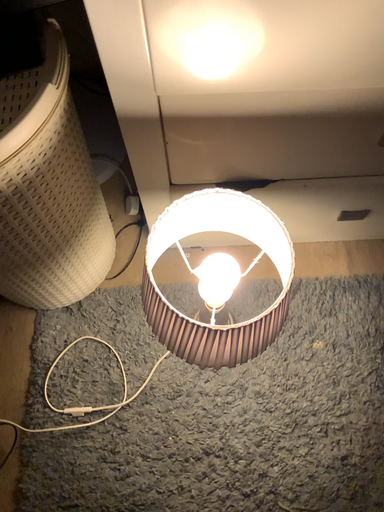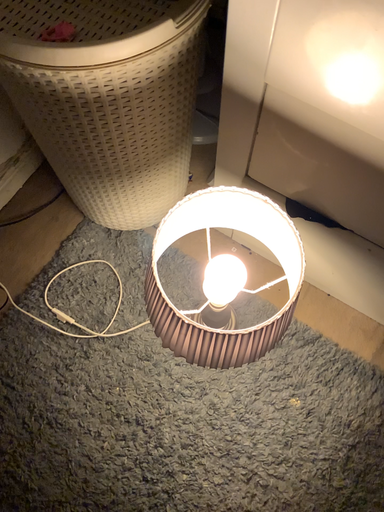
Question: Which way did the camera rotate in the video?

Choices:
 (A) rotated left
 (B) rotated right

Answer: (A)